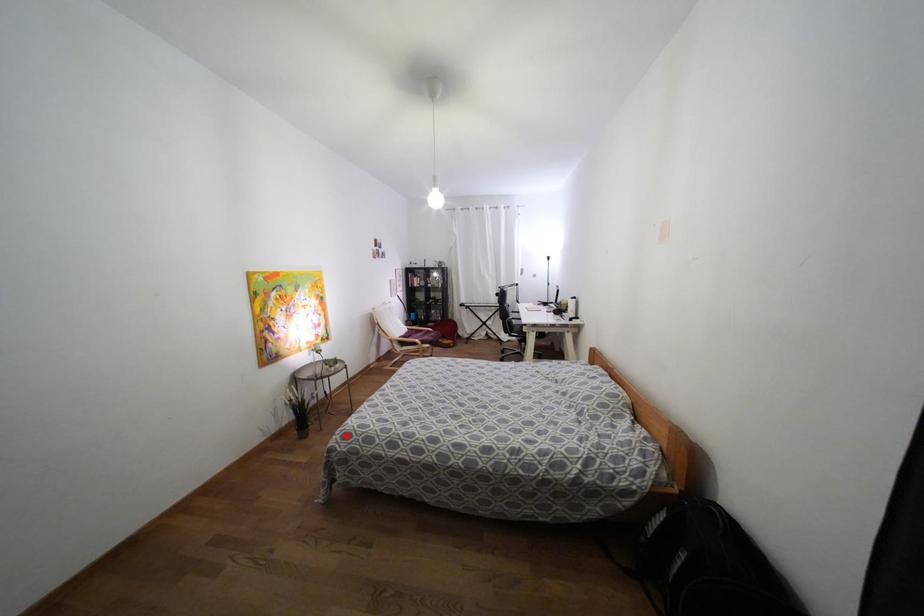
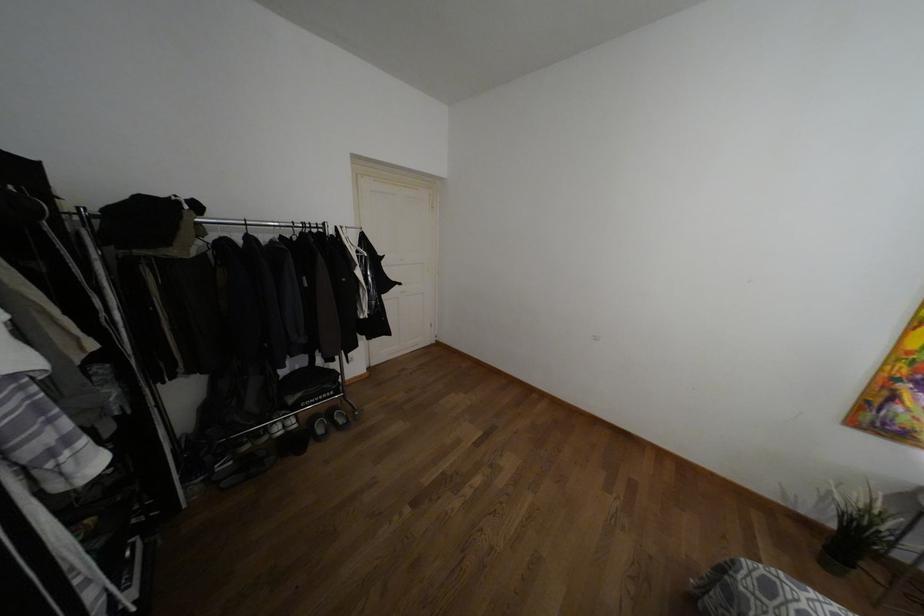
Locate, in the second image, the point that corresponds to the highlighted location in the first image.

(769, 588)